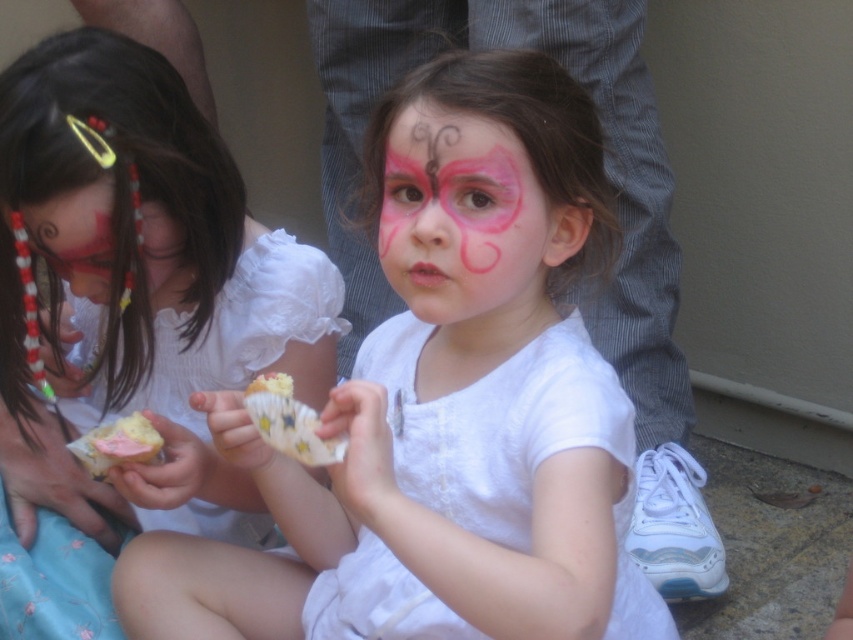
Question: Which point appears farthest from the camera in this image?

Choices:
 (A) (158, 442)
 (B) (279, 388)
 (C) (503, 211)

Answer: (A)

Question: Which object is the closest to the white lace dress at center?

Choices:
 (A) matte black face paint at left
 (B) pink paper cupcake at center
 (C) pink matte butterfly at center

Answer: (C)

Question: Does pink matte butterfly at center have a smaller size compared to pink paper cupcake at center?

Choices:
 (A) yes
 (B) no

Answer: (B)

Question: From the image, what is the correct spatial relationship of matte white dress at center in relation to white paper cupcake at center?

Choices:
 (A) below
 (B) above

Answer: (B)

Question: Does pink matte butterfly at center appear on the right side of pink paper cupcake at center?

Choices:
 (A) no
 (B) yes

Answer: (B)

Question: Which object appears closest to the camera in this image?

Choices:
 (A) white lace dress at center
 (B) matte black face paint at left
 (C) matte white dress at center

Answer: (A)